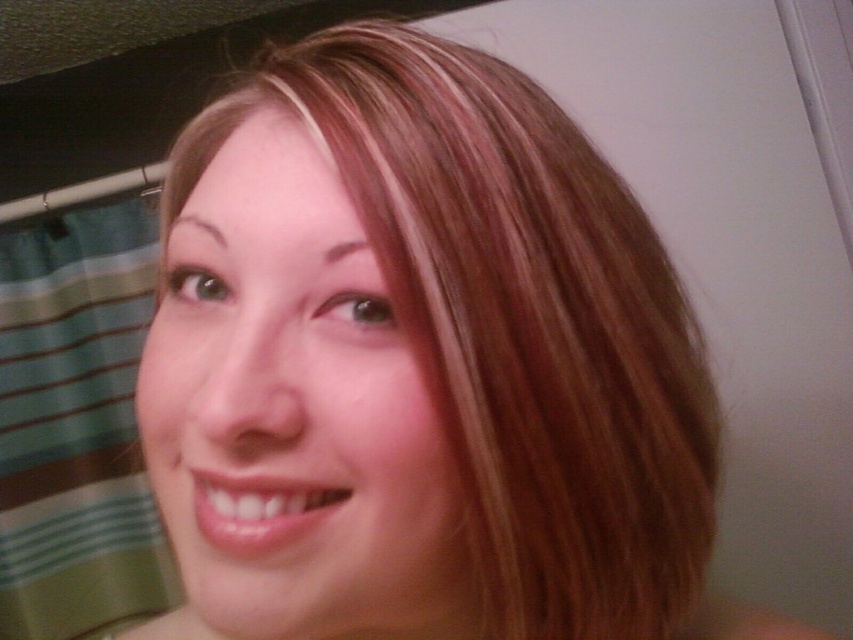
You are a photographer adjusting the focus on a camera. You want to ensure both the blonde hair at center and the smooth skin face at center are in focus. Given that the depth of field can only cover 1 inch, will both objects be in focus?

The blonde hair at center is 1.09 inches away from the smooth skin face at center. Since the depth of field can only cover 1 inch, the distance between them exceeds the depth of field limit. Therefore, both objects cannot be in focus simultaneously.

Based on the scene description, which object is wider when comparing the smooth skin face at center and the green striped fabric at left?

The green striped fabric at left is wider than the smooth skin face at center.

You are a photographer trying to capture a closeup of the blonde hair at center and the green striped fabric at left. Which object appears larger in the frame?

The green striped fabric at left appears larger in the frame because the blonde hair at center is smaller than the green striped fabric at left.